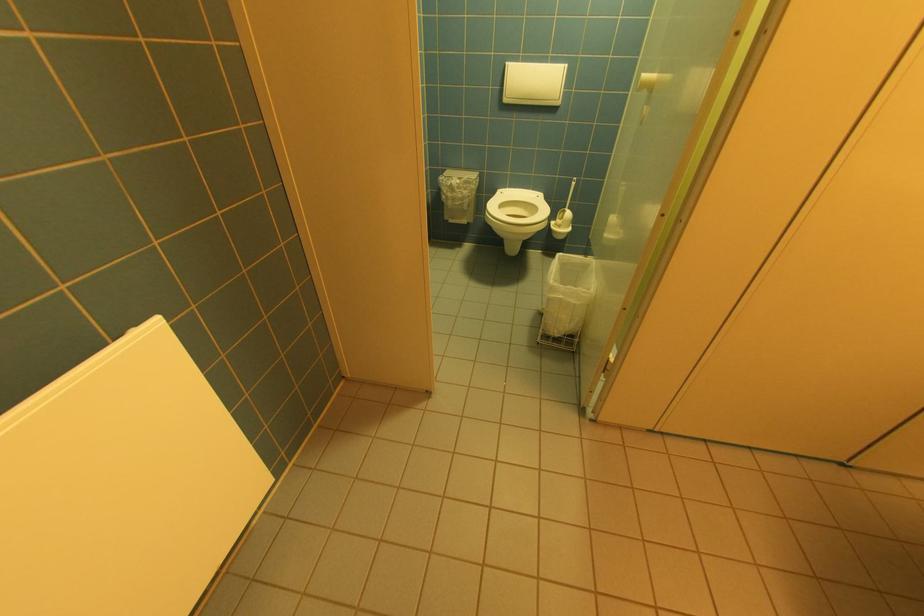
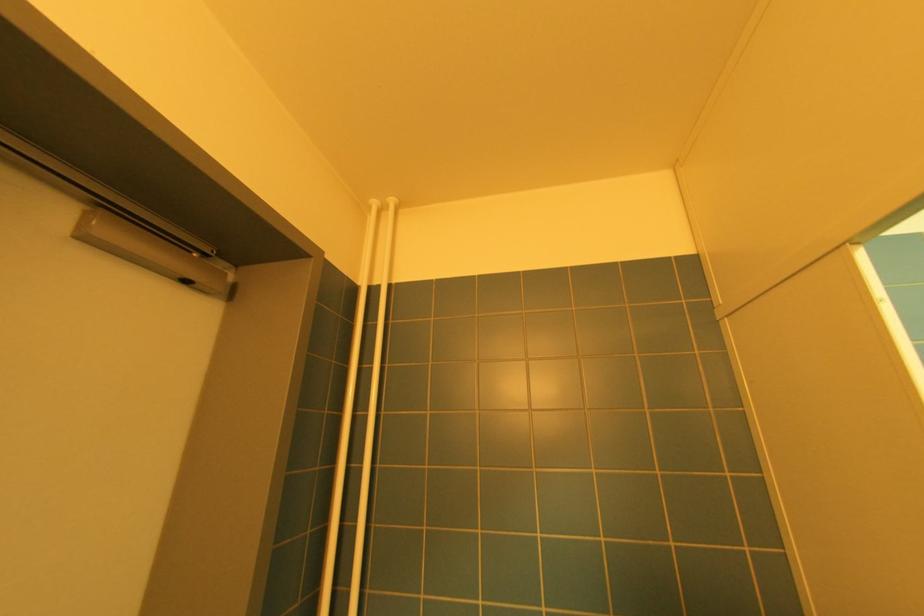
The first image is from the beginning of the video and the second image is from the end. How did the camera likely rotate when shooting the video?

The rotation direction of the camera is left-up.